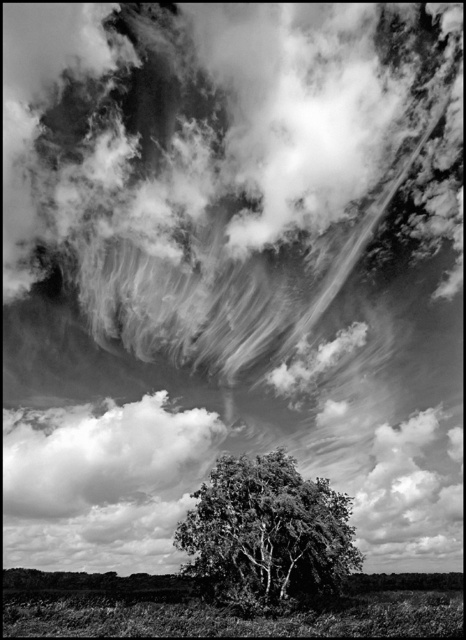
Which of these two, green leafy tree at center or cloudy white cloud at lower center, stands taller?

Standing taller between the two is cloudy white cloud at lower center.

Is green leafy tree at center taller than cloudy white cloud at lower center?

No.

Who is more forward, (294, 483) or (157, 440)?

Point (294, 483) is in front.

At what (x,y) coordinates should I click in order to perform the action: click on green leafy tree at center. Please return your answer as a coordinate pair (x, y). Looking at the image, I should click on (266, 532).